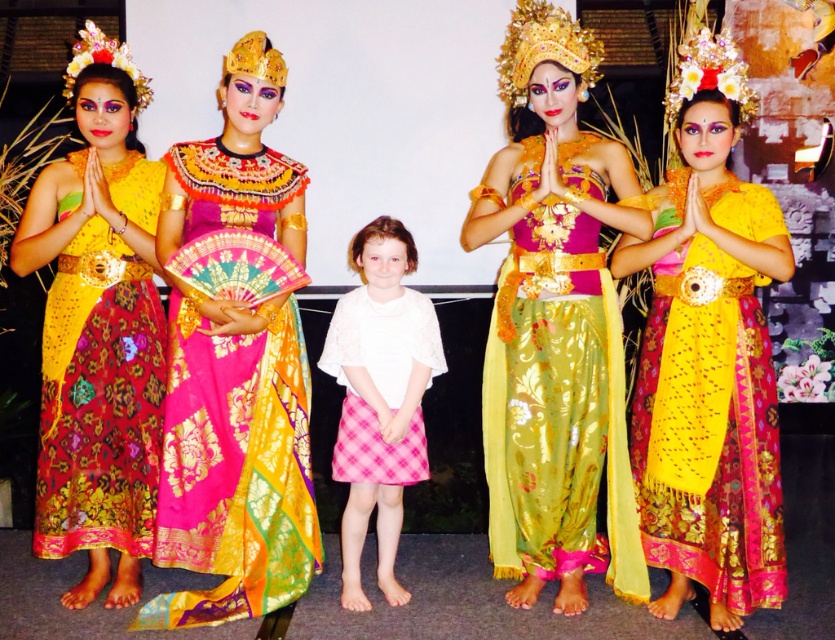
The height and width of the screenshot is (640, 835). What do you see at coordinates (555, 326) in the screenshot?
I see `shiny gold skirt at center` at bounding box center [555, 326].

Who is higher up, shiny gold skirt at center or matte gold fabric dress at left?

shiny gold skirt at center is higher up.

You are a GUI agent. You are given a task and a screenshot of the screen. Output one action in this format:
    pyautogui.click(x=<x>, y=<y>)
    Task: Click on the shiny gold skirt at center
    This screenshot has width=835, height=640.
    Given the screenshot: What is the action you would take?
    pyautogui.click(x=555, y=326)

This screenshot has height=640, width=835. I want to click on shiny gold skirt at center, so click(x=555, y=326).

Is point (216, 323) farther from camera compared to point (719, 212)?

No, it is in front of (719, 212).

In the scene shown: Which is below, shiny silk dress at center or matte yellow fabric dress at center?

Positioned lower is matte yellow fabric dress at center.

Is point (284, 292) less distant than point (734, 428)?

No, it is not.

The image size is (835, 640). I want to click on shiny silk dress at center, so click(235, 362).

Which of these two, matte gold fabric dress at left or matte yellow fabric dress at center, stands shorter?

matte yellow fabric dress at center is shorter.

Is matte gold fabric dress at left to the left of matte yellow fabric dress at center from the viewer's perspective?

Correct, you'll find matte gold fabric dress at left to the left of matte yellow fabric dress at center.

Image resolution: width=835 pixels, height=640 pixels. I want to click on matte gold fabric dress at left, so click(99, 330).

Locate an element on the screen. The height and width of the screenshot is (640, 835). matte gold fabric dress at left is located at coordinates (99, 330).